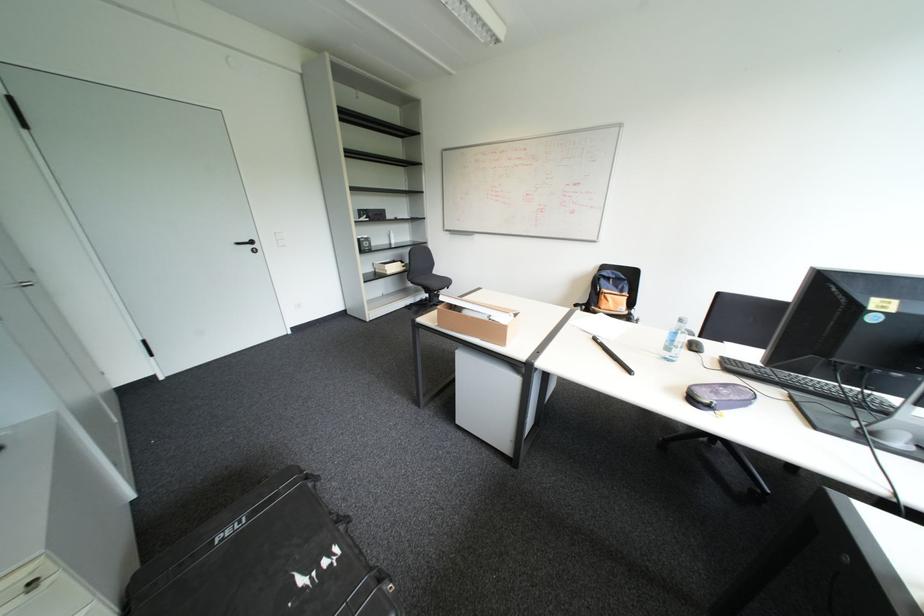
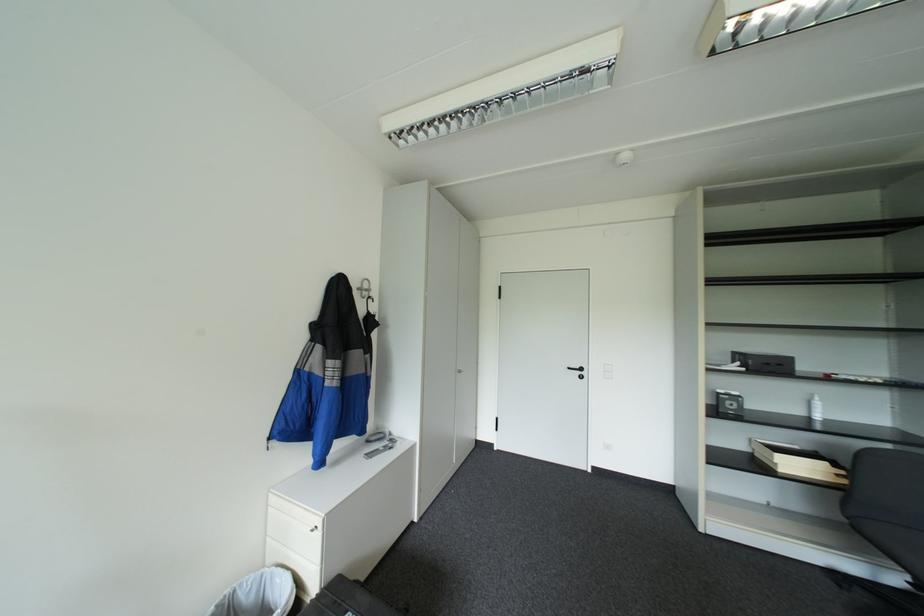
Question: The first image is from the beginning of the video and the second image is from the end. How did the camera likely rotate when shooting the video?

Choices:
 (A) Left
 (B) Right
 (C) Up
 (D) Down

Answer: (A)